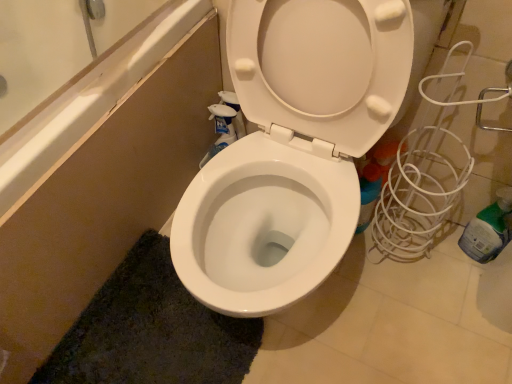
Identify the location of dark green shaggy bath mat at lower left. (151, 331).

Measure the distance between dark green shaggy bath mat at lower left and camera.

dark green shaggy bath mat at lower left is 3.31 feet from camera.

The height and width of the screenshot is (384, 512). Describe the element at coordinates (151, 331) in the screenshot. I see `dark green shaggy bath mat at lower left` at that location.

Measure the distance between point (199, 304) and camera.

A distance of 3.73 feet exists between point (199, 304) and camera.

The width and height of the screenshot is (512, 384). Describe the element at coordinates (488, 229) in the screenshot. I see `green plastic bottle at right` at that location.

I want to click on green plastic bottle at right, so click(488, 229).

Locate an element on the screen. dark green shaggy bath mat at lower left is located at coordinates (151, 331).

Considering the positions of objects dark green shaggy bath mat at lower left and green plastic bottle at right in the image provided, who is more to the left, dark green shaggy bath mat at lower left or green plastic bottle at right?

Positioned to the left is dark green shaggy bath mat at lower left.

Which object is further away from the camera, dark green shaggy bath mat at lower left or green plastic bottle at right?

green plastic bottle at right.

Which is behind, point (130, 282) or point (502, 223)?

Positioned behind is point (130, 282).

From the image's perspective, would you say dark green shaggy bath mat at lower left is shown under green plastic bottle at right?

Yes, from the image's perspective, dark green shaggy bath mat at lower left is below green plastic bottle at right.

From a real-world perspective, which object stands above the other?

In real-world perspective, green plastic bottle at right is above.

Considering the sizes of dark green shaggy bath mat at lower left and green plastic bottle at right in the image, is dark green shaggy bath mat at lower left wider or thinner than green plastic bottle at right?

Clearly, dark green shaggy bath mat at lower left has more width compared to green plastic bottle at right.

Which of these two, dark green shaggy bath mat at lower left or green plastic bottle at right, stands shorter?

With less height is dark green shaggy bath mat at lower left.

From the picture: Considering the sizes of dark green shaggy bath mat at lower left and green plastic bottle at right in the image, is dark green shaggy bath mat at lower left bigger or smaller than green plastic bottle at right?

Considering their sizes, dark green shaggy bath mat at lower left takes up more space than green plastic bottle at right.

Is dark green shaggy bath mat at lower left located outside green plastic bottle at right?

Absolutely, dark green shaggy bath mat at lower left is external to green plastic bottle at right.

Is dark green shaggy bath mat at lower left next to green plastic bottle at right?

They are not placed beside each other.

In the scene shown: Could you tell me if dark green shaggy bath mat at lower left is turned towards green plastic bottle at right?

No, dark green shaggy bath mat at lower left is not aimed at green plastic bottle at right.

How different are the orientations of dark green shaggy bath mat at lower left and green plastic bottle at right in degrees?

There is a 119-degree angle between the facing directions of dark green shaggy bath mat at lower left and green plastic bottle at right.

Measure the distance between dark green shaggy bath mat at lower left and green plastic bottle at right.

dark green shaggy bath mat at lower left is 34.01 inches away from green plastic bottle at right.

I want to click on bath mat on the left of green plastic bottle at right, so click(x=151, y=331).

Considering the relative positions of green plastic bottle at right and dark green shaggy bath mat at lower left in the image provided, is green plastic bottle at right to the left or to the right of dark green shaggy bath mat at lower left?

green plastic bottle at right is positioned on dark green shaggy bath mat at lower left's right side.

Does green plastic bottle at right lie in front of dark green shaggy bath mat at lower left?

That is False.

Which is nearer, (x=470, y=239) or (x=112, y=377)?

Point (x=470, y=239) is positioned farther from the camera compared to point (x=112, y=377).

From the image's perspective, is green plastic bottle at right located above or below dark green shaggy bath mat at lower left?

Based on their image positions, green plastic bottle at right is located above dark green shaggy bath mat at lower left.

From a real-world perspective, is green plastic bottle at right above or below dark green shaggy bath mat at lower left?

green plastic bottle at right is above dark green shaggy bath mat at lower left.

Is green plastic bottle at right wider or thinner than dark green shaggy bath mat at lower left?

Clearly, green plastic bottle at right has less width compared to dark green shaggy bath mat at lower left.

Considering the sizes of green plastic bottle at right and dark green shaggy bath mat at lower left in the image, is green plastic bottle at right taller or shorter than dark green shaggy bath mat at lower left?

Considering their sizes, green plastic bottle at right has more height than dark green shaggy bath mat at lower left.

Is green plastic bottle at right bigger or smaller than dark green shaggy bath mat at lower left?

Considering their sizes, green plastic bottle at right takes up less space than dark green shaggy bath mat at lower left.

Is dark green shaggy bath mat at lower left located within green plastic bottle at right?

No, green plastic bottle at right does not contain dark green shaggy bath mat at lower left.

Is the surface of green plastic bottle at right in direct contact with dark green shaggy bath mat at lower left?

A: No, green plastic bottle at right is not in contact with dark green shaggy bath mat at lower left.

Is green plastic bottle at right oriented away from dark green shaggy bath mat at lower left?

No, green plastic bottle at right is not facing the opposite direction of dark green shaggy bath mat at lower left.

Locate an element on the screen. This screenshot has height=384, width=512. bath mat below the green plastic bottle at right (from the image's perspective) is located at coordinates (151, 331).

Where is `bath mat located in front of the green plastic bottle at right`? The image size is (512, 384). bath mat located in front of the green plastic bottle at right is located at coordinates (151, 331).

Where is `bottle behind the dark green shaggy bath mat at lower left`? The image size is (512, 384). bottle behind the dark green shaggy bath mat at lower left is located at coordinates [488, 229].